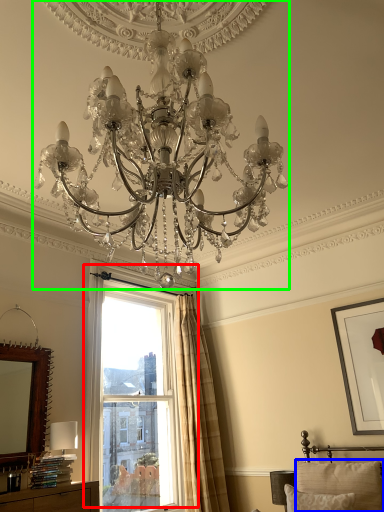
Question: Considering the real-world distances, which object is closest to window (highlighted by a red box)? pillow (highlighted by a blue box) or lamp (highlighted by a green box).

Choices:
 (A) pillow
 (B) lamp

Answer: (A)